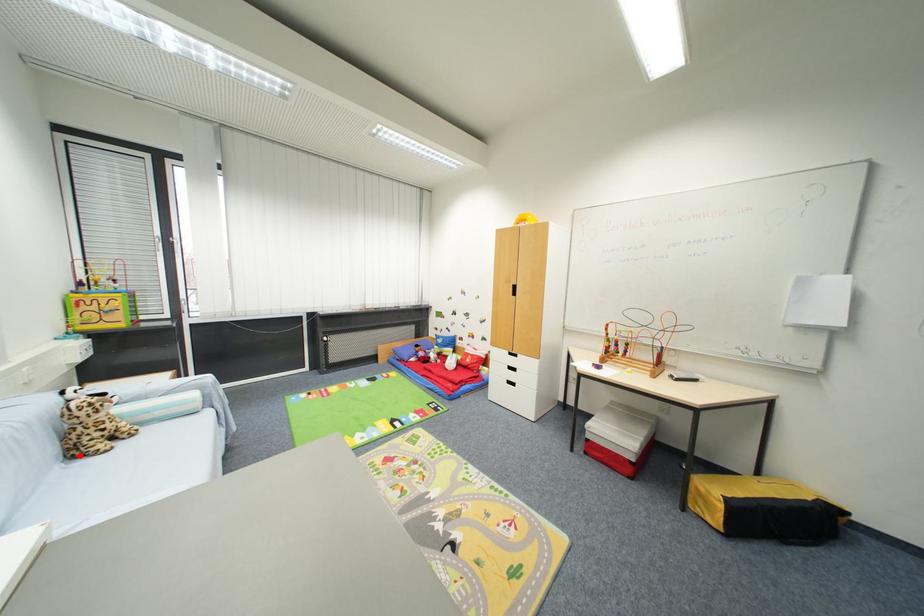
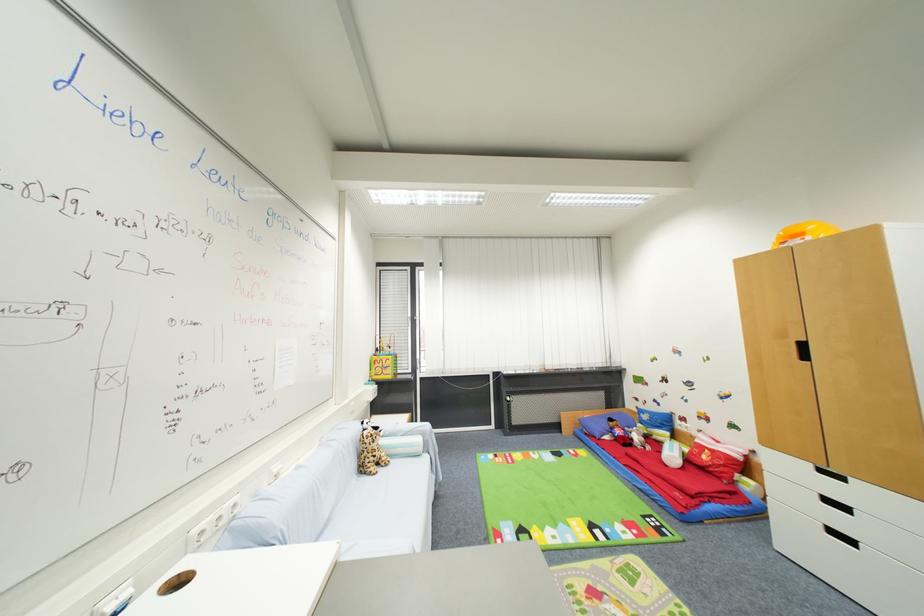
Question: I am providing you with two images of the same scene from different viewpoints. In image1, a red point is highlighted. Considering the same 3D point in image2, which of the following is correct?

Choices:
 (A) It is closer
 (B) It is farther

Answer: (A)